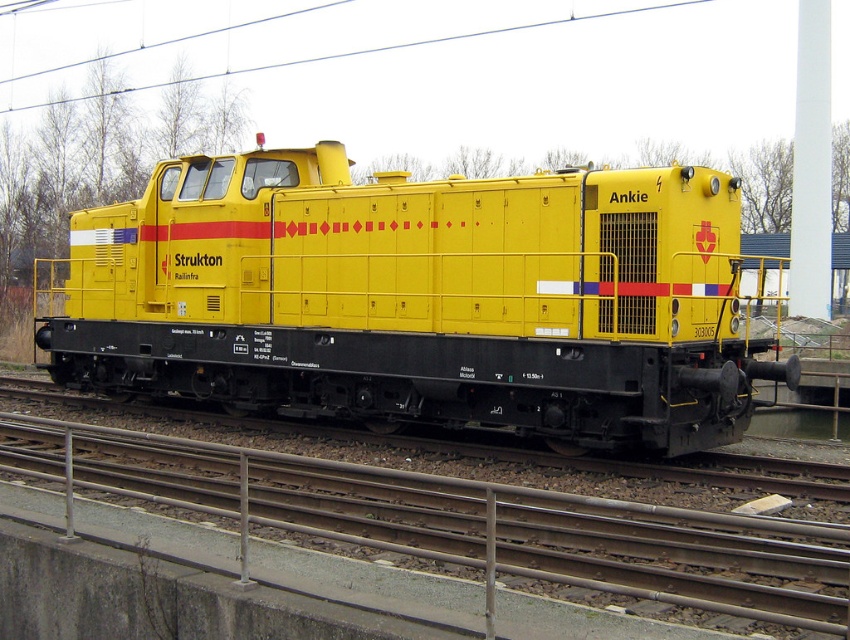
You are a railway inspector standing at the platform observing the yellow matte train at center and the metal at center. Which object is closer to you?

The yellow matte train at center is closer to you because the metal at center is behind it.

You are a railway inspector checking the locomotive Ankie. You notice two components on the locomotive. One is the metal at center, and the other is the metallic wire at upper center. Which component is positioned lower on the locomotive?

The metal at center is located below the metallic wire at upper center, so the metal at center is positioned lower on the locomotive.